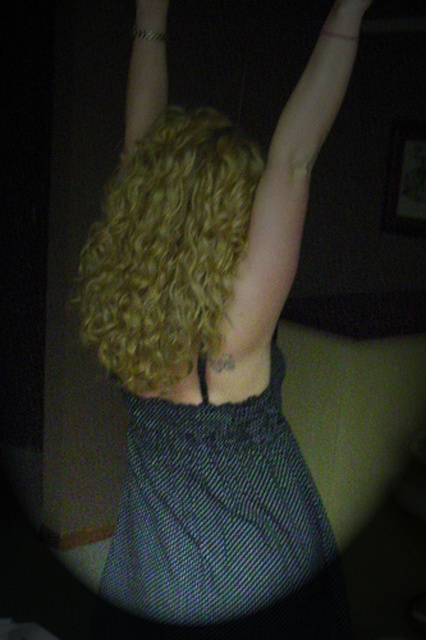
Is smooth skin arm at upper center below metallic bracelet at upper center?

Yes.

Between smooth skin arm at upper center and metallic bracelet at upper center, which one has more height?

With more height is smooth skin arm at upper center.

The width and height of the screenshot is (426, 640). What are the coordinates of `smooth skin arm at upper center` in the screenshot? It's located at (287, 193).

Image resolution: width=426 pixels, height=640 pixels. I want to click on textured black dress at center, so click(219, 528).

Which is behind, point (294, 547) or point (164, 44)?

Point (164, 44)

Identify the location of textured black dress at center. This screenshot has height=640, width=426. (219, 528).

This screenshot has width=426, height=640. What do you see at coordinates (167, 250) in the screenshot?
I see `curly blonde hair at center` at bounding box center [167, 250].

Which is in front, point (112, 291) or point (138, 115)?

Point (112, 291) is in front.

Describe the element at coordinates (167, 250) in the screenshot. I see `curly blonde hair at center` at that location.

Locate an element on the screen. Image resolution: width=426 pixels, height=640 pixels. curly blonde hair at center is located at coordinates (167, 250).